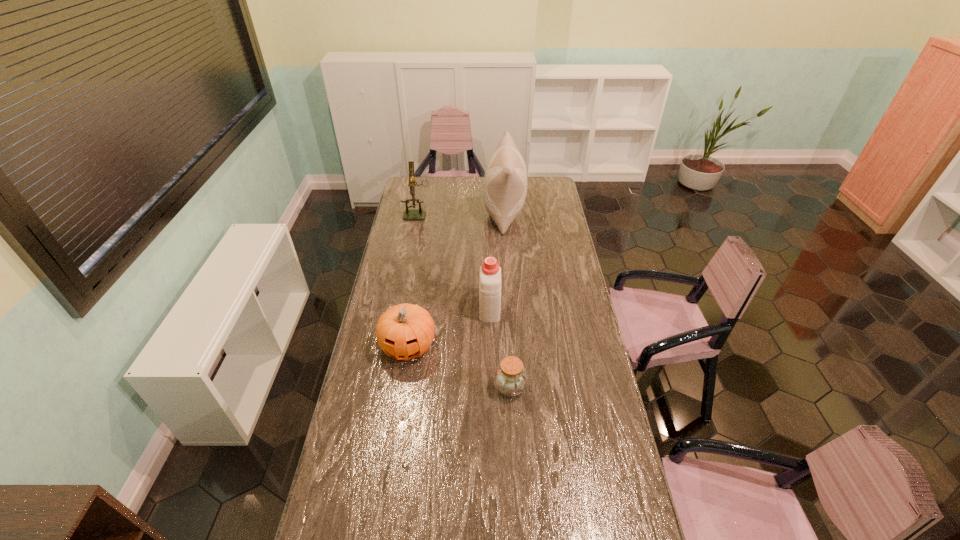
At what (x,y) coordinates should I click in order to perform the action: click on free spot between the third farthest object and the second shortest object. Please return your answer as a coordinate pair (x, y). The height and width of the screenshot is (540, 960). Looking at the image, I should click on click(x=448, y=327).

Identify the location of free area in between the third nearest object and the microscope. The width and height of the screenshot is (960, 540). (453, 260).

You are a GUI agent. You are given a task and a screenshot of the screen. Output one action in this format:
    pyautogui.click(x=<x>, y=<y>)
    Task: Click on the vacant space that's between the cushion and the microscope
    This screenshot has width=960, height=540.
    Given the screenshot: What is the action you would take?
    pyautogui.click(x=461, y=213)

Locate which object ranks second in proximity to the microscope. Please provide its 2D coordinates. Your answer should be formatted as a tuple, i.e. [(x, y)], where the tuple contains the x and y coordinates of a point satisfying the conditions above.

[(490, 272)]

The height and width of the screenshot is (540, 960). I want to click on object that is the closest to the second shortest object, so click(490, 272).

Image resolution: width=960 pixels, height=540 pixels. What are the coordinates of `blank area in the image that satisfies the following two spatial constraints: 1. on the front-facing side of the second nearest object; 2. on the left side of the shortest object` in the screenshot? It's located at (401, 388).

What are the coordinates of `vacant space that satisfies the following two spatial constraints: 1. on the front-facing side of the second shortest object; 2. on the left side of the shortest object` in the screenshot? It's located at (401, 388).

This screenshot has height=540, width=960. What are the coordinates of `free space that satisfies the following two spatial constraints: 1. on the front-facing side of the nearest object; 2. on the left side of the pumpkin` in the screenshot? It's located at (401, 388).

Where is `vacant space that satisfies the following two spatial constraints: 1. on the front-facing side of the shortest object; 2. on the right side of the second shortest object`? The width and height of the screenshot is (960, 540). vacant space that satisfies the following two spatial constraints: 1. on the front-facing side of the shortest object; 2. on the right side of the second shortest object is located at coordinates (401, 388).